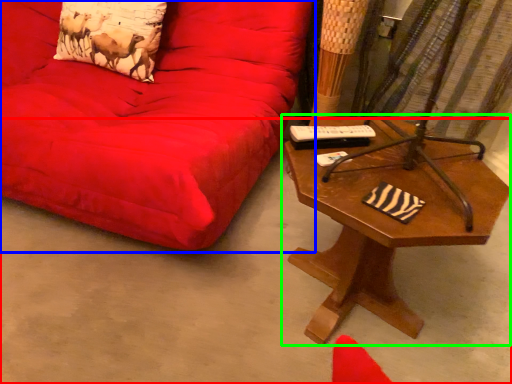
Question: Which object is the farthest from concrete (highlighted by a red box)? Choose among these: studio couch (highlighted by a blue box) or table (highlighted by a green box).

Choices:
 (A) studio couch
 (B) table

Answer: (B)